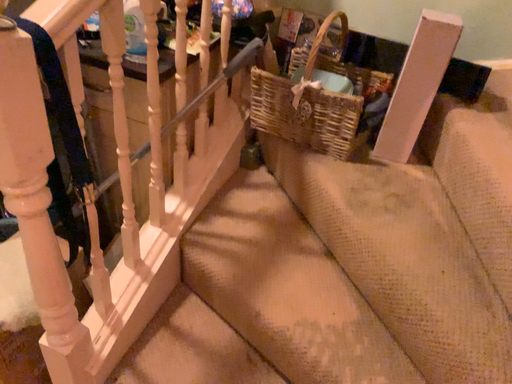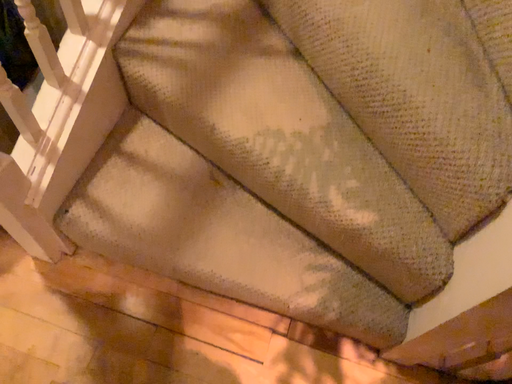
Question: How did the camera likely rotate when shooting the video?

Choices:
 (A) rotated upward
 (B) rotated downward

Answer: (B)